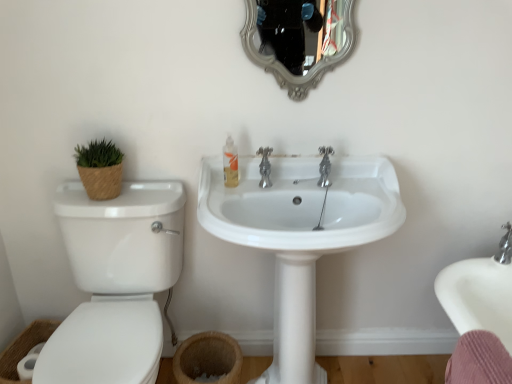
What do you see at coordinates (230, 163) in the screenshot? The height and width of the screenshot is (384, 512). I see `translucent plastic soap dispenser at center` at bounding box center [230, 163].

Identify the location of white glossy sink at center. The image size is (512, 384). (300, 234).

You are a GUI agent. You are given a task and a screenshot of the screen. Output one action in this format:
    pyautogui.click(x=<x>, y=<y>)
    Task: Click on the silver/gilded mirror at upper center
    
    Given the screenshot: What is the action you would take?
    point(298,39)

Considering the sizes of objects silver/gilded mirror at upper center and white glossy toilet at left in the image provided, who is shorter, silver/gilded mirror at upper center or white glossy toilet at left?

silver/gilded mirror at upper center.

Is white glossy toilet at left at the back of silver/gilded mirror at upper center?

silver/gilded mirror at upper center does not have its back to white glossy toilet at left.

Measure the distance from silver/gilded mirror at upper center to white glossy toilet at left.

35.22 inches.

How different are the orientations of silver/gilded mirror at upper center and white glossy toilet at left in degrees?

They differ by 0.249 degrees in their facing directions.

Is chrome metallic faucet at center far from translucent plastic soap dispenser at center?

That's not correct — chrome metallic faucet at center is a little close to translucent plastic soap dispenser at center.

Does chrome metallic faucet at center have a smaller size compared to translucent plastic soap dispenser at center?

No.

Image resolution: width=512 pixels, height=384 pixels. I want to click on tap in front of the translucent plastic soap dispenser at center, so click(x=265, y=167).

Consider the image. Does silver/gilded mirror at upper center have a greater height compared to white glossy sink at center?

Incorrect, the height of silver/gilded mirror at upper center is not larger of that of white glossy sink at center.

Can you confirm if silver/gilded mirror at upper center is positioned to the left of white glossy sink at center?

Incorrect, silver/gilded mirror at upper center is not on the left side of white glossy sink at center.

Does silver/gilded mirror at upper center touch white glossy sink at center?

They are not placed beside each other.

Between silver/gilded mirror at upper center and white glossy sink at center, which one is positioned in front?

white glossy sink at center is closer to the camera.

Which of these two, translucent plastic soap dispenser at center or silver/gilded mirror at upper center, stands shorter?

translucent plastic soap dispenser at center.

From a real-world perspective, which object rests below the other?

translucent plastic soap dispenser at center is physically lower.

Can you confirm if translucent plastic soap dispenser at center is thinner than silver/gilded mirror at upper center?

No.

The image size is (512, 384). I want to click on toiletry below the silver/gilded mirror at upper center (from a real-world perspective), so click(x=230, y=163).

Is white glossy sink at center to the right of silver/gilded mirror at upper center from the viewer's perspective?

In fact, white glossy sink at center is to the left of silver/gilded mirror at upper center.

Is white glossy sink at center not within silver/gilded mirror at upper center?

Absolutely, white glossy sink at center is external to silver/gilded mirror at upper center.

From the image's perspective, which one is positioned lower, white glossy sink at center or silver/gilded mirror at upper center?

From the image's view, white glossy sink at center is below.

Can you confirm if white glossy toilet at left is shorter than chrome metallic faucet at center?

In fact, white glossy toilet at left may be taller than chrome metallic faucet at center.

Which is behind, point (146, 195) or point (260, 163)?

The point (146, 195) is farther from the camera.

Does white glossy toilet at left have a larger size compared to chrome metallic faucet at center?

Yes, white glossy toilet at left is bigger than chrome metallic faucet at center.

Is white glossy toilet at left inside or outside of chrome metallic faucet at center?

white glossy toilet at left lies outside chrome metallic faucet at center.

Can you confirm if translucent plastic soap dispenser at center is thinner than white glossy toilet at left?

Correct, the width of translucent plastic soap dispenser at center is less than that of white glossy toilet at left.

Considering the positions of objects translucent plastic soap dispenser at center and white glossy toilet at left in the image provided, who is more to the left, translucent plastic soap dispenser at center or white glossy toilet at left?

From the viewer's perspective, white glossy toilet at left appears more on the left side.

From a real-world perspective, is translucent plastic soap dispenser at center located beneath white glossy toilet at left?

No, from a real-world perspective, translucent plastic soap dispenser at center is not under white glossy toilet at left.

Where is `mirror behind the white glossy toilet at left`? This screenshot has height=384, width=512. mirror behind the white glossy toilet at left is located at coordinates (298, 39).

This screenshot has width=512, height=384. Find the location of `tap in front of the translucent plastic soap dispenser at center`. tap in front of the translucent plastic soap dispenser at center is located at coordinates (265, 167).

Which object lies nearer to the anchor point silver/gilded mirror at upper center, chrome metallic faucet at center or white glossy sink at center?

The object closer to silver/gilded mirror at upper center is white glossy sink at center.

Estimate the real-world distances between objects in this image. Which object is further from chrome metallic faucet at center, white glossy toilet at left or white glossy sink at center?

white glossy toilet at left is positioned further to the anchor chrome metallic faucet at center.

Estimate the real-world distances between objects in this image. Which object is closer to translucent plastic soap dispenser at center, white glossy toilet at left or chrome metallic faucet at center?

chrome metallic faucet at center lies closer to translucent plastic soap dispenser at center than the other object.

Which object lies nearer to the anchor point chrome metallic faucet at center, translucent plastic soap dispenser at center or white glossy sink at center?

translucent plastic soap dispenser at center is closer to chrome metallic faucet at center.

Looking at the image, which one is located closer to white glossy toilet at left, white glossy sink at center or chrome metallic faucet at center?

white glossy sink at center is closer to white glossy toilet at left.

Looking at the image, which one is located closer to white glossy sink at center, silver/gilded mirror at upper center or translucent plastic soap dispenser at center?

translucent plastic soap dispenser at center is positioned closer to the anchor white glossy sink at center.

Estimate the real-world distances between objects in this image. Which object is further from white glossy sink at center, translucent plastic soap dispenser at center or white glossy toilet at left?

Based on the image, white glossy toilet at left appears to be further to white glossy sink at center.

In the scene shown: From the image, which object appears to be farther from white glossy toilet at left, white glossy sink at center or translucent plastic soap dispenser at center?

translucent plastic soap dispenser at center.

Identify the location of toiletry between silver/gilded mirror at upper center and white glossy sink at center in the vertical direction. The image size is (512, 384). (230, 163).

Identify the location of toiletry situated between white glossy toilet at left and white glossy sink at center from left to right. (230, 163).

This screenshot has width=512, height=384. Identify the location of tap between silver/gilded mirror at upper center and white glossy sink at center from top to bottom. (265, 167).

Where is `toiletry between silver/gilded mirror at upper center and chrome metallic faucet at center vertically`? toiletry between silver/gilded mirror at upper center and chrome metallic faucet at center vertically is located at coordinates (230, 163).